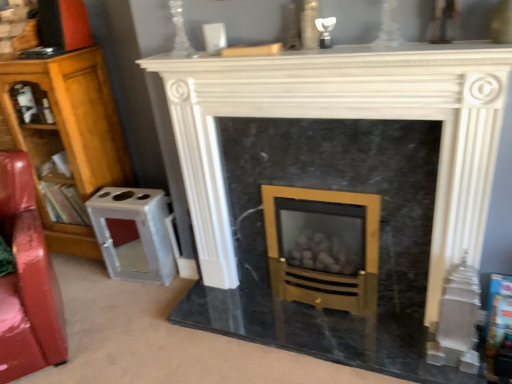
Where is `vacant space in front of white marble fireplace at center`? This screenshot has width=512, height=384. vacant space in front of white marble fireplace at center is located at coordinates (345, 348).